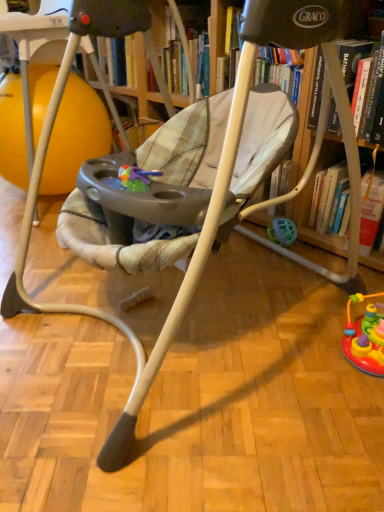
Question: Can you confirm if orange rubber ball at left is taller than wooden bookshelf at right?

Choices:
 (A) yes
 (B) no

Answer: (A)

Question: From the image's perspective, is orange rubber ball at left on wooden bookshelf at right?

Choices:
 (A) no
 (B) yes

Answer: (B)

Question: Is orange rubber ball at left wider than wooden bookshelf at right?

Choices:
 (A) no
 (B) yes

Answer: (B)

Question: Would you say wooden bookshelf at right is part of orange rubber ball at left's contents?

Choices:
 (A) no
 (B) yes

Answer: (A)

Question: Can you confirm if orange rubber ball at left is shorter than wooden bookshelf at right?

Choices:
 (A) yes
 (B) no

Answer: (B)

Question: From the image's perspective, would you say orange rubber ball at left is shown under wooden bookshelf at right?

Choices:
 (A) no
 (B) yes

Answer: (A)

Question: Is wooden bookshelf at right to the left of orange rubber ball at left from the viewer's perspective?

Choices:
 (A) no
 (B) yes

Answer: (A)

Question: Does wooden bookshelf at right lie behind orange rubber ball at left?

Choices:
 (A) no
 (B) yes

Answer: (A)

Question: From a real-world perspective, is wooden bookshelf at right on top of orange rubber ball at left?

Choices:
 (A) no
 (B) yes

Answer: (A)

Question: From a real-world perspective, is wooden bookshelf at right under orange rubber ball at left?

Choices:
 (A) yes
 (B) no

Answer: (A)

Question: Is wooden bookshelf at right facing towards orange rubber ball at left?

Choices:
 (A) no
 (B) yes

Answer: (A)

Question: Is wooden bookshelf at right far away from orange rubber ball at left?

Choices:
 (A) no
 (B) yes

Answer: (B)

Question: Does point (59, 136) appear closer or farther from the camera than point (332, 246)?

Choices:
 (A) farther
 (B) closer

Answer: (A)